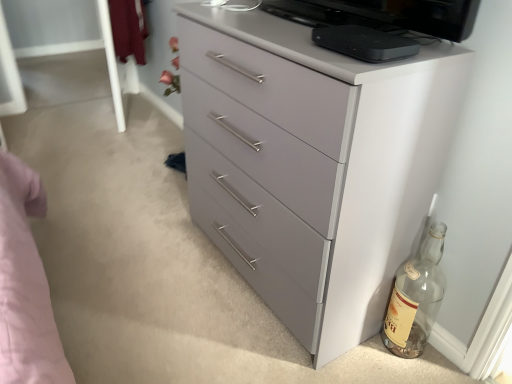
What do you see at coordinates (416, 298) in the screenshot?
I see `transparent glass bottle at lower right` at bounding box center [416, 298].

This screenshot has height=384, width=512. Identify the location of transparent glass bottle at lower right. (416, 298).

From a real-world perspective, between matte gray chest of drawers at center and black matte device at upper center, who is vertically higher?

black matte device at upper center is physically above.

Based on the photo, between matte gray chest of drawers at center and black matte device at upper center, which one is positioned in front?

matte gray chest of drawers at center is in front.

Is matte gray chest of drawers at center taller or shorter than black matte device at upper center?

Considering their sizes, matte gray chest of drawers at center has more height than black matte device at upper center.

From the image's perspective, does transparent glass bottle at lower right appear lower than black matte device at upper center?

Yes, from the image's perspective, transparent glass bottle at lower right is below black matte device at upper center.

Looking at this image, which object is positioned more to the left, transparent glass bottle at lower right or black matte device at upper center?

From the viewer's perspective, black matte device at upper center appears more on the left side.

Is transparent glass bottle at lower right in front of black matte device at upper center?

No, it is behind black matte device at upper center.

Is there a large distance between transparent glass bottle at lower right and black matte device at upper center?

Actually, transparent glass bottle at lower right and black matte device at upper center are a little close together.

Are black matte device at upper center and transparent glass bottle at lower right located far from each other?

No.

Do you think black matte device at upper center is within transparent glass bottle at lower right, or outside of it?

black matte device at upper center is located beyond the bounds of transparent glass bottle at lower right.

From the image's perspective, between black matte device at upper center and transparent glass bottle at lower right, who is located below?

transparent glass bottle at lower right is shown below in the image.

Based on the photo, in the image, is black matte device at upper center on the left side or the right side of transparent glass bottle at lower right?

Based on their positions, black matte device at upper center is located to the left of transparent glass bottle at lower right.

Is point (392, 49) positioned after point (208, 204)?

No, it is not.

Which object is thinner, black matte device at upper center or matte gray chest of drawers at center?

With smaller width is black matte device at upper center.

Does black matte device at upper center touch matte gray chest of drawers at center?

No, black matte device at upper center is not beside matte gray chest of drawers at center.

From the image's perspective, which one is positioned lower, black matte device at upper center or matte gray chest of drawers at center?

matte gray chest of drawers at center is shown below in the image.

Considering the sizes of transparent glass bottle at lower right and matte gray chest of drawers at center in the image, is transparent glass bottle at lower right wider or thinner than matte gray chest of drawers at center?

Clearly, transparent glass bottle at lower right has less width compared to matte gray chest of drawers at center.

Consider the image. Can you tell me how much transparent glass bottle at lower right and matte gray chest of drawers at center differ in facing direction?

The angle between the facing direction of transparent glass bottle at lower right and the facing direction of matte gray chest of drawers at center is 0.205 degrees.

Which is behind, transparent glass bottle at lower right or matte gray chest of drawers at center?

transparent glass bottle at lower right is further away from the camera.

Locate an element on the screen. the chest of drawers in front of the transparent glass bottle at lower right is located at coordinates (312, 164).

From the image's perspective, is matte gray chest of drawers at center below transparent glass bottle at lower right?

No, from the image's perspective, matte gray chest of drawers at center is not below transparent glass bottle at lower right.

Can you confirm if matte gray chest of drawers at center is positioned to the right of transparent glass bottle at lower right?

In fact, matte gray chest of drawers at center is to the left of transparent glass bottle at lower right.

In the scene shown: Is matte gray chest of drawers at center positioned beyond the bounds of transparent glass bottle at lower right?

Indeed, matte gray chest of drawers at center is completely outside transparent glass bottle at lower right.

Find the location of a particular element. This screenshot has width=512, height=384. appliance above the matte gray chest of drawers at center (from the image's perspective) is located at coordinates (365, 43).

This screenshot has height=384, width=512. There is a transparent glass bottle at lower right. In order to click on appliance above it (from a real-world perspective) in this screenshot , I will do `click(365, 43)`.

Estimate the real-world distances between objects in this image. Which object is closer to transparent glass bottle at lower right, matte gray chest of drawers at center or black matte device at upper center?

Based on the image, matte gray chest of drawers at center appears to be nearer to transparent glass bottle at lower right.

From the picture: Based on their spatial positions, is matte gray chest of drawers at center or transparent glass bottle at lower right further from black matte device at upper center?

transparent glass bottle at lower right.

Estimate the real-world distances between objects in this image. Which object is closer to matte gray chest of drawers at center, black matte device at upper center or transparent glass bottle at lower right?

The object closer to matte gray chest of drawers at center is black matte device at upper center.

When comparing their distances from black matte device at upper center, does transparent glass bottle at lower right or matte gray chest of drawers at center seem further?

transparent glass bottle at lower right is further to black matte device at upper center.

From the image, which object appears to be nearer to transparent glass bottle at lower right, black matte device at upper center or matte gray chest of drawers at center?

Based on the image, matte gray chest of drawers at center appears to be nearer to transparent glass bottle at lower right.

Which object lies further to the anchor point matte gray chest of drawers at center, transparent glass bottle at lower right or black matte device at upper center?

transparent glass bottle at lower right is further to matte gray chest of drawers at center.

Locate an element on the screen. The width and height of the screenshot is (512, 384). chest of drawers between black matte device at upper center and transparent glass bottle at lower right in the up-down direction is located at coordinates pos(312,164).